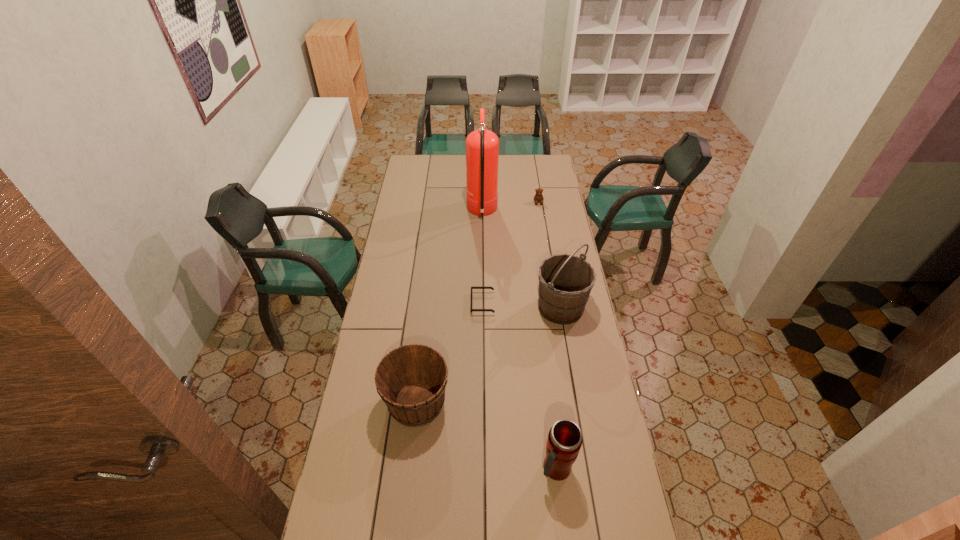
Identify the location of fire extinguisher. (482, 146).

Image resolution: width=960 pixels, height=540 pixels. In order to click on the fifth shortest object in this screenshot , I will do `click(565, 281)`.

Locate an element on the screen. The width and height of the screenshot is (960, 540). the third tallest object is located at coordinates (564, 441).

Identify the location of thermos bottle. This screenshot has height=540, width=960. (564, 441).

Locate an element on the screen. the fourth tallest object is located at coordinates click(x=411, y=380).

The height and width of the screenshot is (540, 960). Find the location of `the leftmost object`. the leftmost object is located at coordinates (x=411, y=380).

In order to click on the second shortest object in this screenshot , I will do `click(538, 197)`.

You are a GUI agent. You are given a task and a screenshot of the screen. Output one action in this format:
    pyautogui.click(x=<x>, y=<y>)
    Task: Click on the shortest object
    The width and height of the screenshot is (960, 540).
    Given the screenshot: What is the action you would take?
    pyautogui.click(x=492, y=288)

The image size is (960, 540). Identify the location of blank space located towards the nozzle of the fire extinguisher. (450, 212).

The image size is (960, 540). Identify the location of vacant space situated 0.260m towards the nozzle of the fire extinguisher. (419, 212).